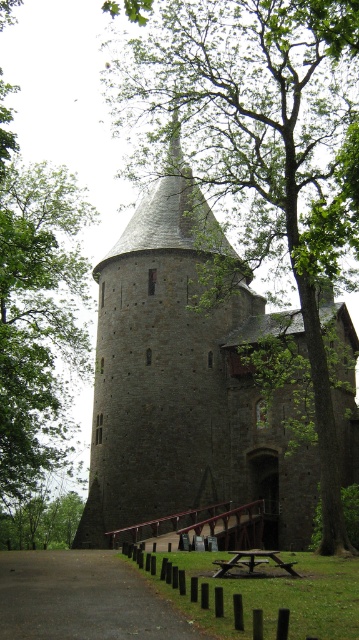
Between green leafy tree at left and dark asphalt path at lower center, which one appears on the left side from the viewer's perspective?

green leafy tree at left

From the picture: Can you confirm if green leafy tree at left is positioned above dark asphalt path at lower center?

Indeed, green leafy tree at left is positioned over dark asphalt path at lower center.

Find the location of a particular element. green leafy tree at left is located at coordinates (36, 310).

Does point (26, 592) come in front of point (31, 529)?

Yes, point (26, 592) is in front of point (31, 529).

Does point (75, 620) come behind point (80, 504)?

No, (75, 620) is closer to viewer.

Who is more distant from viewer, (170,636) or (63,531)?

Point (63,531)

Locate an element on the screen. The image size is (359, 640). dark asphalt path at lower center is located at coordinates (82, 598).

You are a GUI agent. You are given a task and a screenshot of the screen. Output one action in this format:
    pyautogui.click(x=<x>, y=<y>)
    Task: Click on the green leafy tree at lower left
    
    Given the screenshot: What is the action you would take?
    pyautogui.click(x=42, y=522)

Does green leafy tree at lower left have a smaller size compared to wooden picnic table at lower center?

No, green leafy tree at lower left is not smaller than wooden picnic table at lower center.

The image size is (359, 640). Describe the element at coordinates (42, 522) in the screenshot. I see `green leafy tree at lower left` at that location.

This screenshot has height=640, width=359. In order to click on green leafy tree at lower left in this screenshot , I will do `click(42, 522)`.